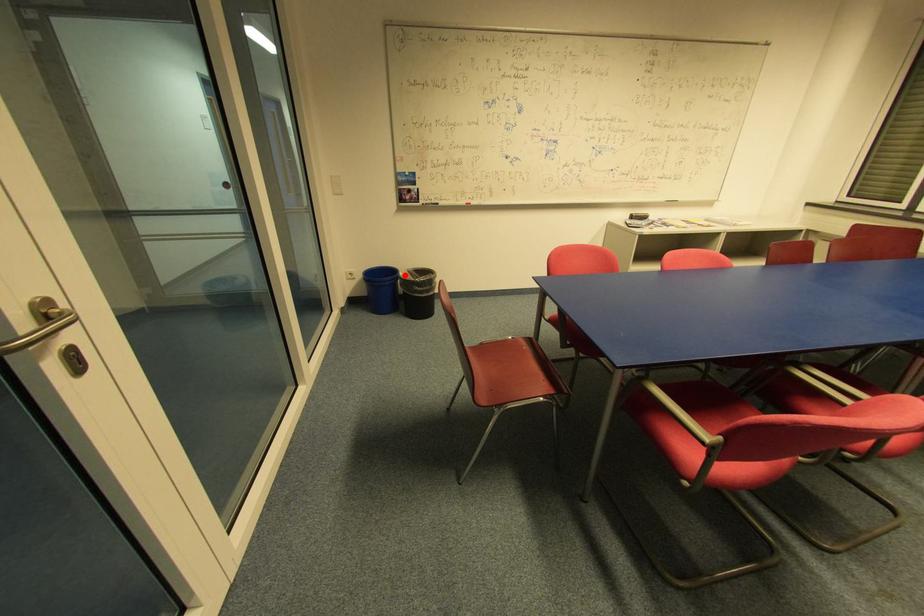
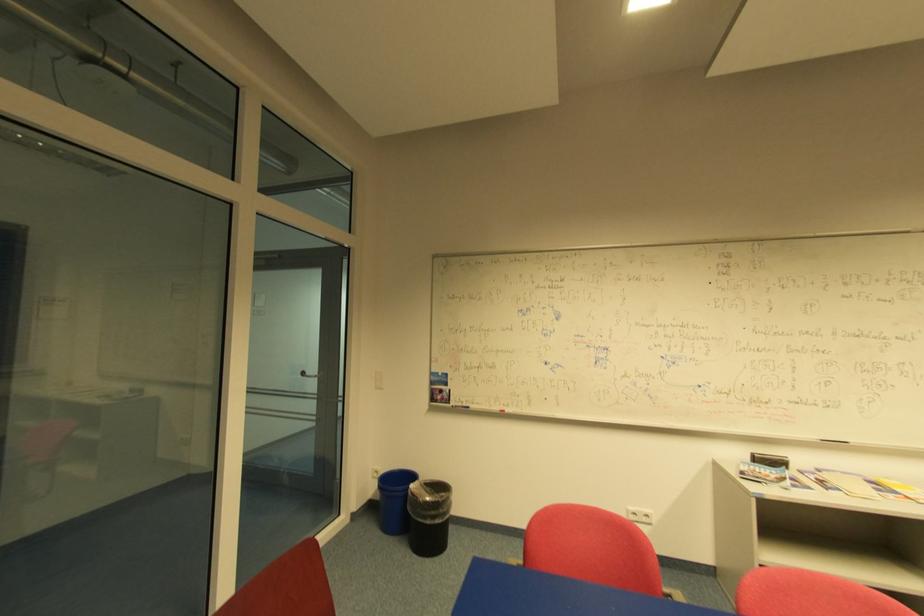
Where in the second image is the point corresponding to the highlighted location from the first image?

(416, 485)